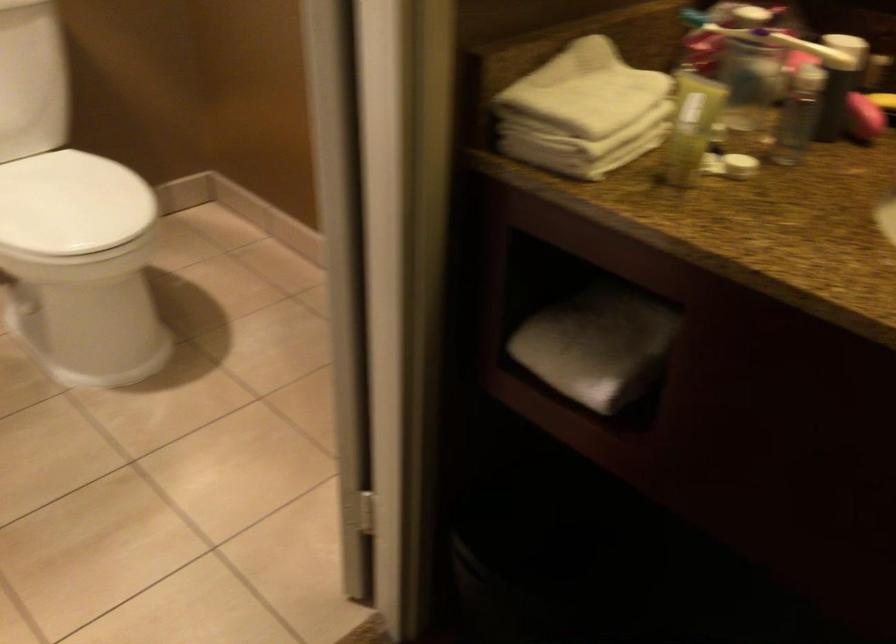
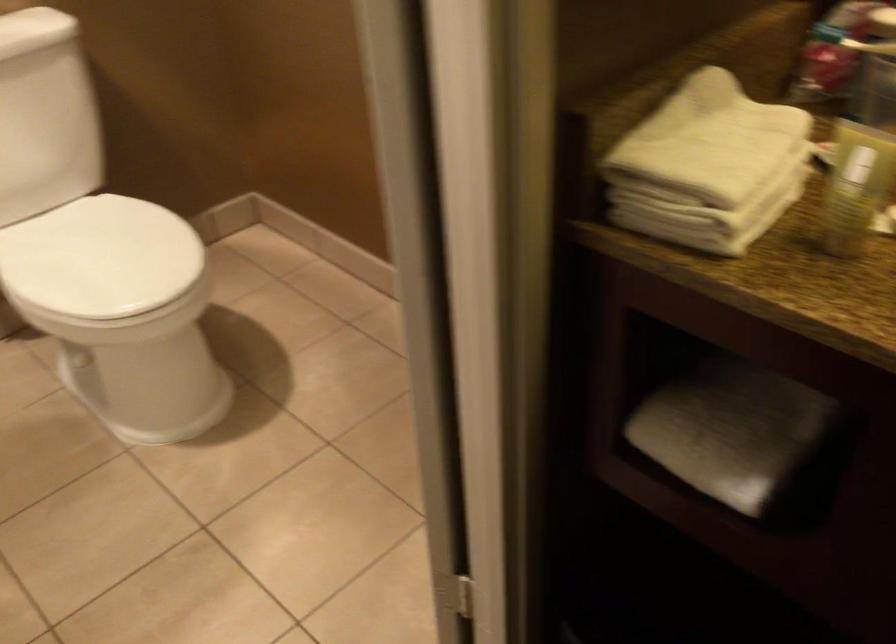
Which direction would the cameraman need to move to produce the second image?

The movement direction of the cameraman is left, forward.